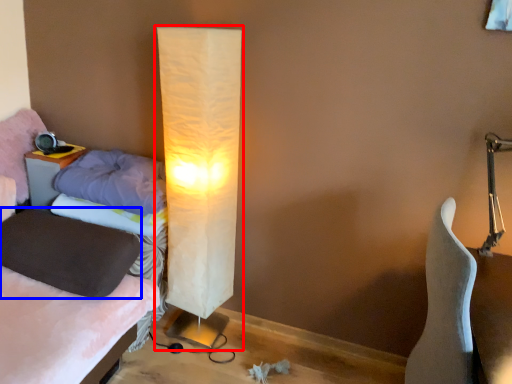
Question: Which point is closer to the camera, lamp (highlighted by a red box) or pillow (highlighted by a blue box)?

Choices:
 (A) lamp
 (B) pillow

Answer: (A)